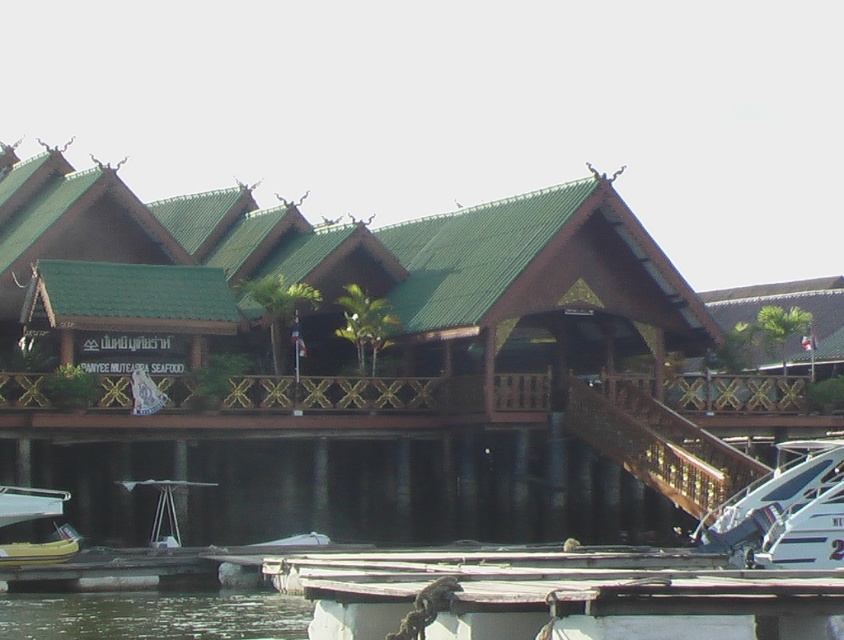
You are standing at the camera position and want to throw a stone into the clear water at lower left. If your throwing range is 50 meters, will you be able to reach it?

The clear water at lower left is 47.50 meters away from the camera, so yes, you can reach it with your throwing range of 50 meters.